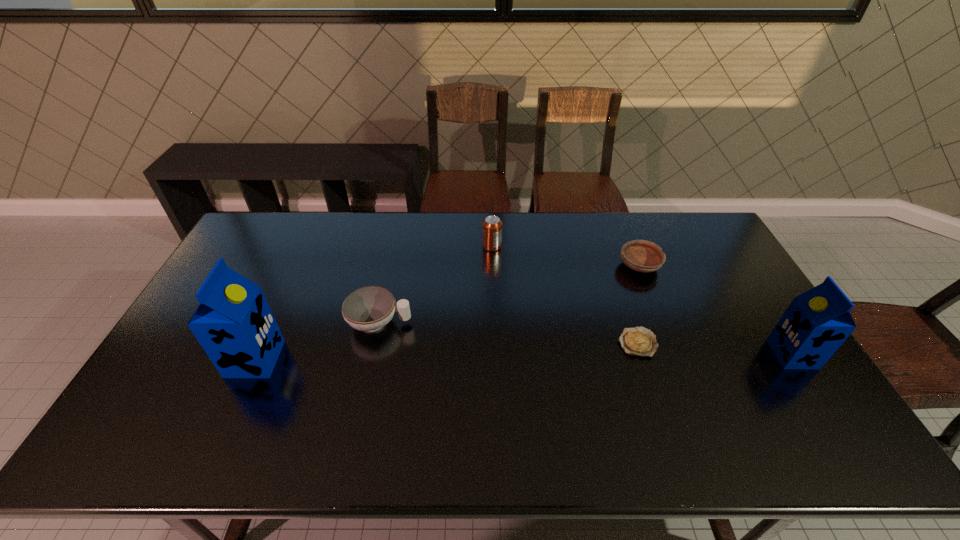
Find the location of a particular element. This screenshot has width=960, height=540. object located in the right edge section of the desktop is located at coordinates (816, 323).

In the image, there is a desktop. Where is `vacant area at the far edge`? The image size is (960, 540). vacant area at the far edge is located at coordinates (402, 247).

In the image, there is a desktop. Where is `blank space at the near edge`? The width and height of the screenshot is (960, 540). blank space at the near edge is located at coordinates (294, 409).

Where is `vacant area at the left edge`? This screenshot has height=540, width=960. vacant area at the left edge is located at coordinates (184, 370).

Find the location of a particular element. The width and height of the screenshot is (960, 540). vacant space at the right edge of the desktop is located at coordinates (732, 318).

Locate an element on the screen. blank space at the near left corner is located at coordinates pos(150,405).

Where is `vacant space at the near right corner of the desktop`? vacant space at the near right corner of the desktop is located at coordinates (782, 414).

Find the location of a particular element. The height and width of the screenshot is (540, 960). free spot between the shorter carton and the fourth tallest object is located at coordinates (586, 339).

Where is `free space that is in between the chinaware and the third tallest object`? The width and height of the screenshot is (960, 540). free space that is in between the chinaware and the third tallest object is located at coordinates (436, 284).

Locate an element on the screen. The image size is (960, 540). free space between the leftmost object and the bowl is located at coordinates (447, 312).